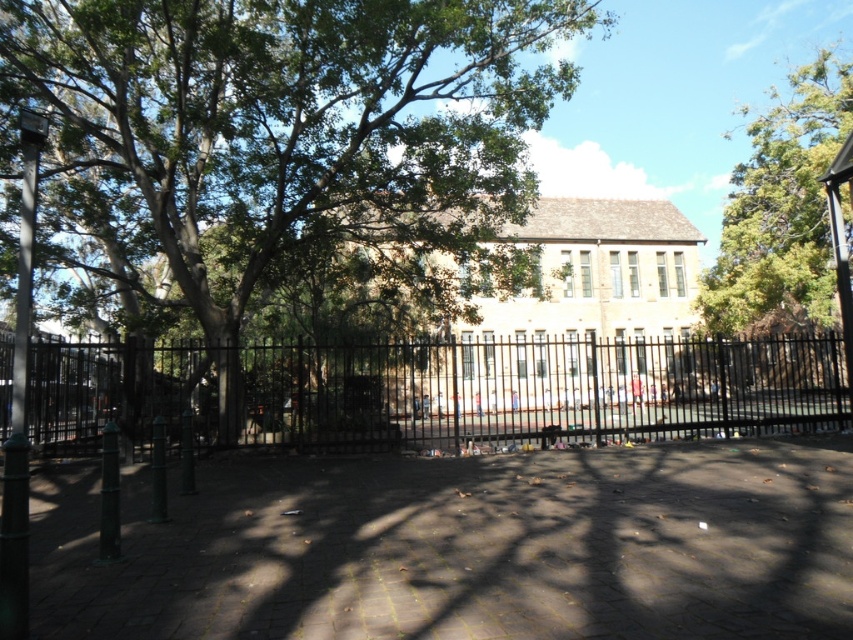
You are a gardener planning to trim the branches of both the green leafy tree at center and the green leafy tree at upper right. Based on their sizes, which tree might require a taller ladder?

The green leafy tree at upper right is larger than the green leafy tree at center, so you would need a taller ladder for the green leafy tree at upper right.

You are a landscape architect planning to install a new bench between the green leafy tree at center and the green leafy tree at upper right. Given that the bench requires at least 5 meters of space between the trees to be placed comfortably, is the current distance sufficient?

The distance between the green leafy tree at center and the green leafy tree at upper right is 14.87 meters, which is more than the required 5 meters. Therefore, the bench can be comfortably placed between them with sufficient space.

You are a visitor trying to take a photo of the green leafy tree at upper right from the paved area. Since the black metal fence at center is between you and the tree, will you be able to see the top of the tree over the fence?

The black metal fence at center is not as tall as green leafy tree at upper right, so yes, you can see the top of the green leafy tree at upper right over the fence.